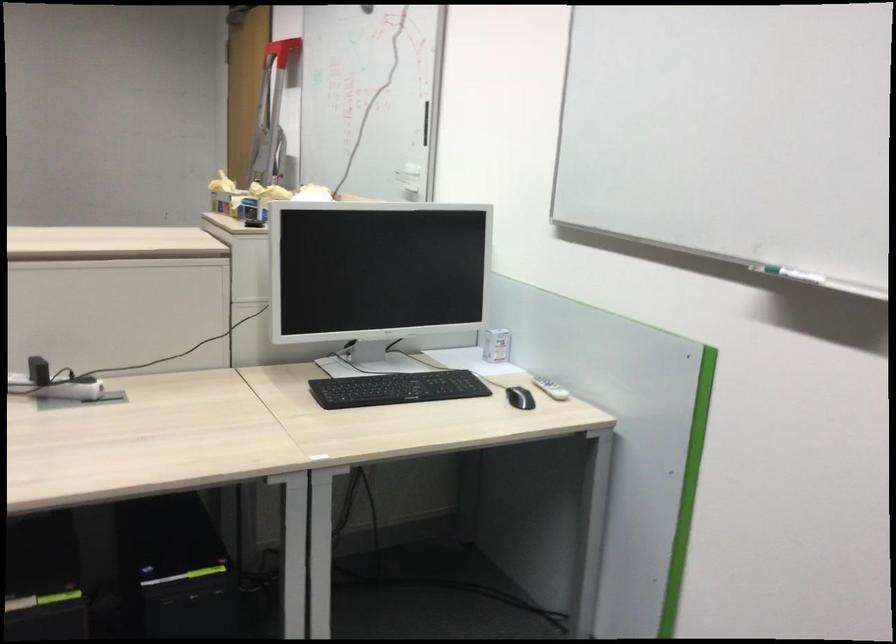
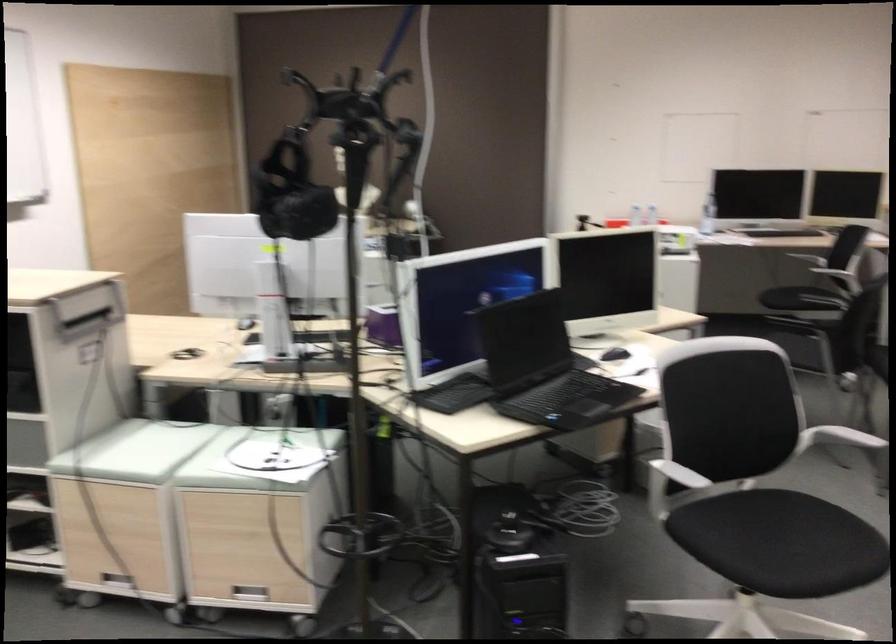
Question: I am providing you with two images of the same scene from different viewpoints. Please identify which objects are invisible in image2.

Choices:
 (A) black chair sitting surface
 (B) brown oval tray
 (C) white power adapter
 (D) black VR headset

Answer: (C)